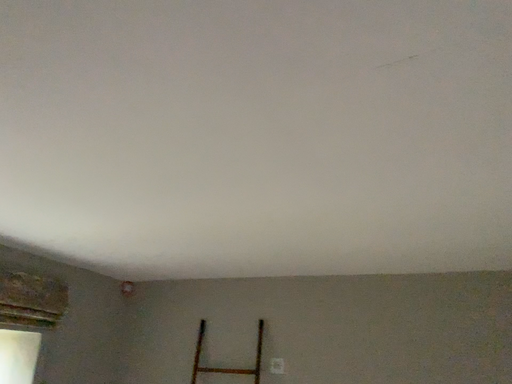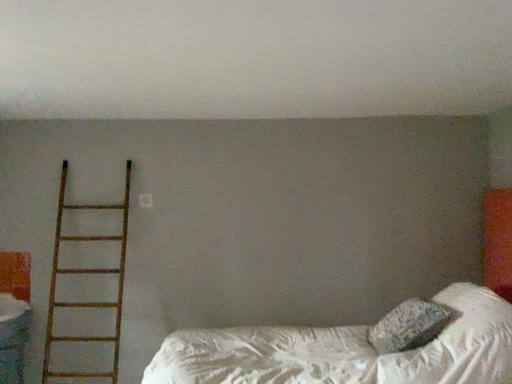
Question: Which way did the camera rotate in the video?

Choices:
 (A) rotated right
 (B) rotated left

Answer: (A)